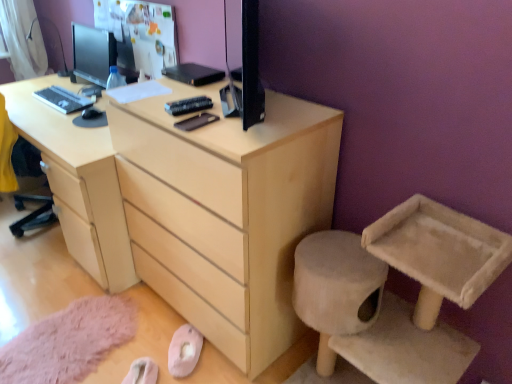
Question: From the image's perspective, is light wood chest of drawers at center positioned above or below light wood desk at center?

Choices:
 (A) above
 (B) below

Answer: (B)

Question: Relative to light wood desk at center, is light wood chest of drawers at center in front or behind?

Choices:
 (A) front
 (B) behind

Answer: (A)

Question: Considering the real-world distances, which object is closest to the beige fabric cat tree at lower right?

Choices:
 (A) matte black keyboard at left
 (B) matte black monitor at upper left
 (C) light wood chest of drawers at center
 (D) light wood desk at center

Answer: (C)

Question: Which is farther from the light wood desk at center?

Choices:
 (A) matte black keyboard at left
 (B) beige fabric cat tree at lower right
 (C) matte black monitor at upper left
 (D) light wood chest of drawers at center

Answer: (B)